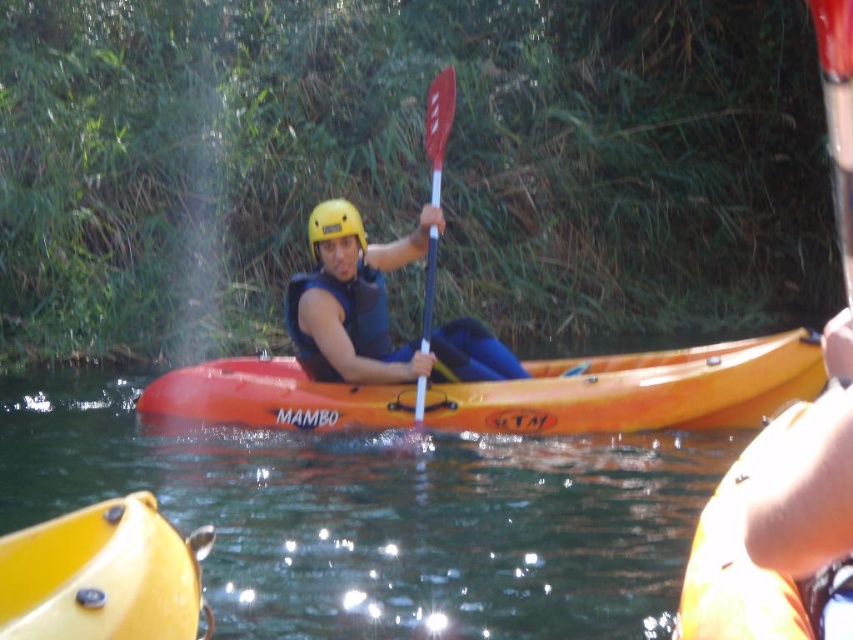
You are a safety inspector checking the equipment of a kayaker. You notice the matte blue life vest at center and the yellow matte helmet at center. Which piece of safety gear has a greater width?

The matte blue life vest at center has a greater width than the yellow matte helmet at center.

You are standing on the shore and want to throw a rope to the person wearing the matte blue life vest at center. The rope you have is 6 meters long. Can you reach them?

The matte blue life vest at center is 6.79 meters away from the viewer. Since the rope is only 6 meters long, it is not long enough to reach the person wearing the matte blue life vest at center.